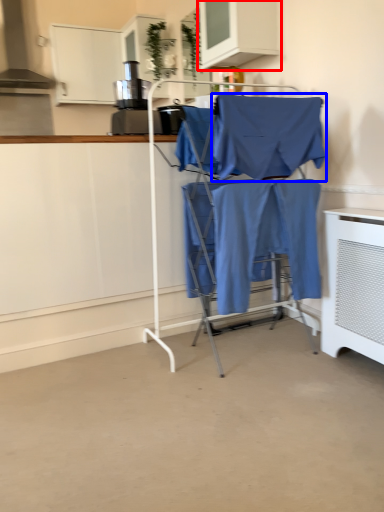
Question: Which object appears closest to the camera in this image, cabinetry (highlighted by a red box) or fabric (highlighted by a blue box)?

Choices:
 (A) cabinetry
 (B) fabric

Answer: (B)